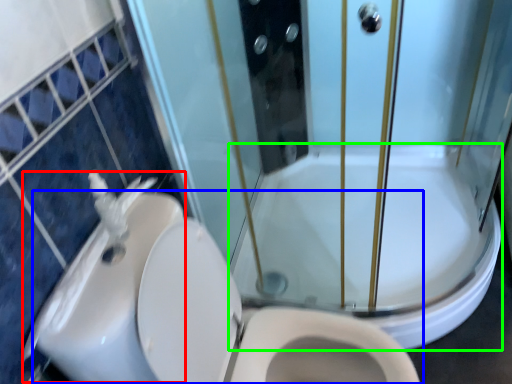
Question: Which object is the farthest from sink (highlighted by a red box)? Choose among these: toilet (highlighted by a blue box) or bath (highlighted by a green box).

Choices:
 (A) toilet
 (B) bath

Answer: (B)